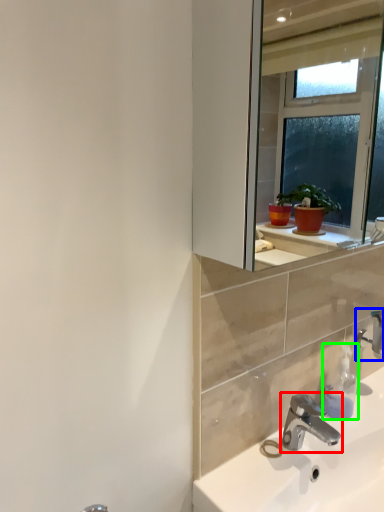
Question: Estimate the real-world distances between objects in this image. Which object is farther from tap (highlighted by a red box), tap (highlighted by a blue box) or soap dispenser (highlighted by a green box)?

Choices:
 (A) tap
 (B) soap dispenser

Answer: (A)